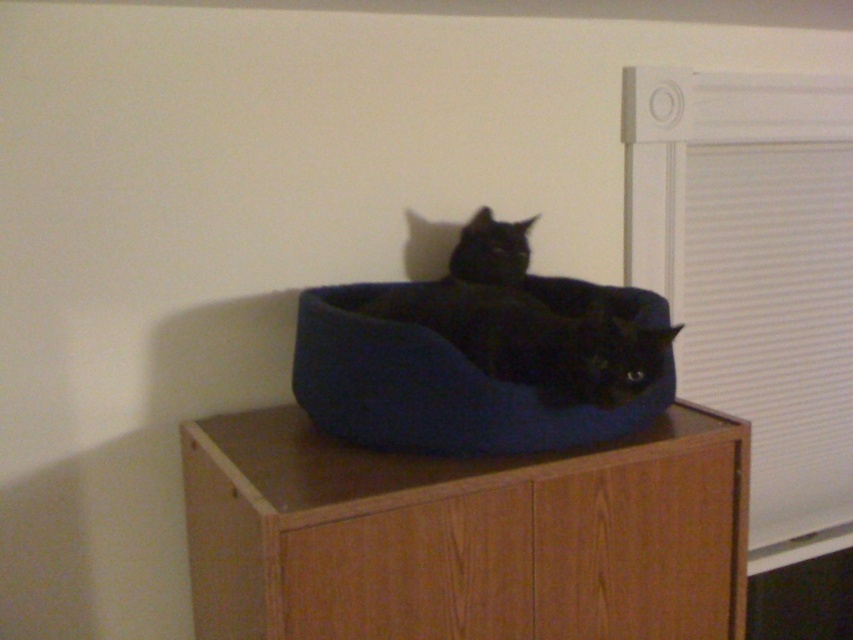
Question: Which object is positioned farthest from the blue plush cat bed at center?

Choices:
 (A) wooden dresser at center
 (B) black soft cushion at center

Answer: (A)

Question: Which of the following is the farthest from the observer?

Choices:
 (A) wooden dresser at center
 (B) black soft cushion at center
 (C) blue plush cat bed at center

Answer: (B)

Question: Is white fabric blinds at right closer to the viewer compared to blue plush cat bed at center?

Choices:
 (A) yes
 (B) no

Answer: (B)

Question: Is wooden dresser at center bigger than white fabric blinds at right?

Choices:
 (A) yes
 (B) no

Answer: (A)

Question: Based on their relative distances, which object is nearer to the blue plush cat bed at center?

Choices:
 (A) wooden dresser at center
 (B) white fabric blinds at right
 (C) black soft cushion at center

Answer: (C)

Question: Is wooden dresser at center smaller than blue plush cat bed at center?

Choices:
 (A) yes
 (B) no

Answer: (B)